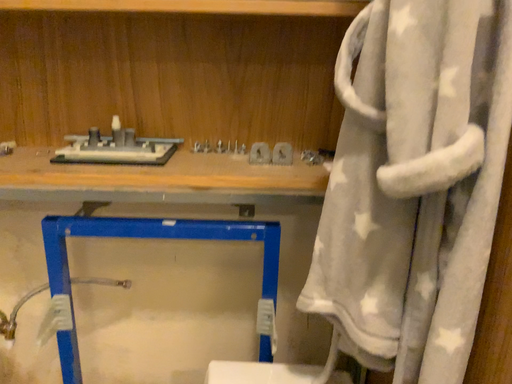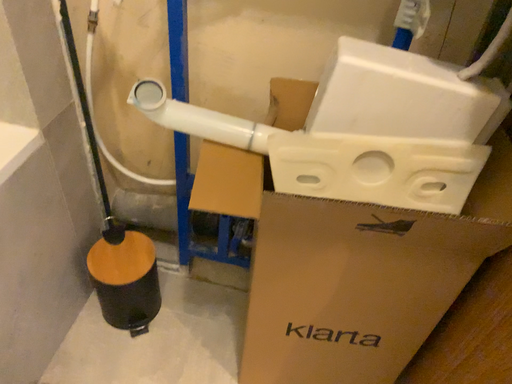
Question: How did the camera likely rotate when shooting the video?

Choices:
 (A) rotated right
 (B) rotated left

Answer: (B)